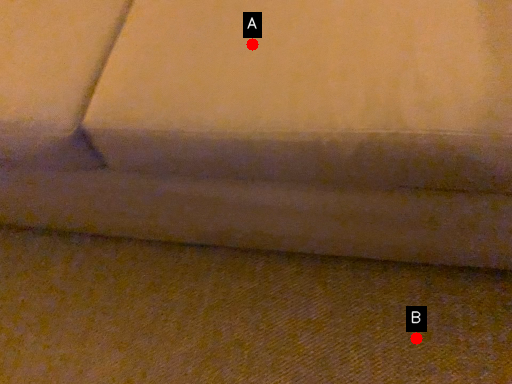
Question: Two points are circled on the image, labeled by A and B beside each circle. Which point is further to the camera?

Choices:
 (A) A is further
 (B) B is further

Answer: (B)